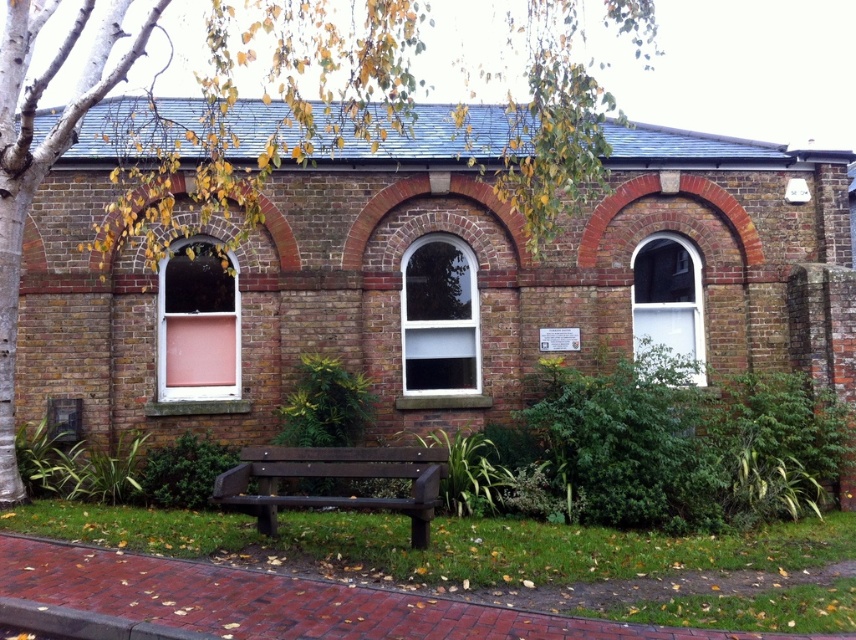
Question: Which of these objects is positioned farthest from the brown wooden bench at center?

Choices:
 (A) green leafy tree at upper left
 (B) pink glass window at left

Answer: (A)

Question: Can you confirm if white glass window at center is positioned below white glass window at upper right?

Choices:
 (A) no
 (B) yes

Answer: (B)

Question: Does green leafy tree at upper left have a greater width compared to white glass window at upper right?

Choices:
 (A) yes
 (B) no

Answer: (A)

Question: Which object is closer to the camera taking this photo?

Choices:
 (A) pink glass window at left
 (B) green leafy tree at upper left
 (C) white glass window at center

Answer: (B)

Question: Can you confirm if green leafy tree at upper left is smaller than pink glass window at left?

Choices:
 (A) no
 (B) yes

Answer: (A)

Question: Which of the following is the farthest from the observer?

Choices:
 (A) brown wooden bench at center
 (B) green leafy tree at upper left

Answer: (A)